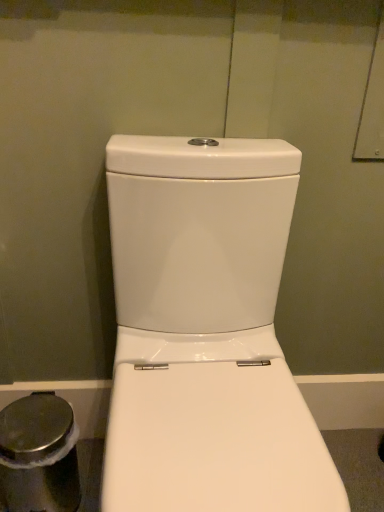
The width and height of the screenshot is (384, 512). Describe the element at coordinates (205, 333) in the screenshot. I see `white glossy toilet at center` at that location.

The width and height of the screenshot is (384, 512). I want to click on white glossy toilet at center, so click(205, 333).

Consider the image. Measure the distance between point (191,357) and camera.

Point (191,357) is 33.62 inches from camera.

Identify the location of white glossy toilet at center. (205, 333).